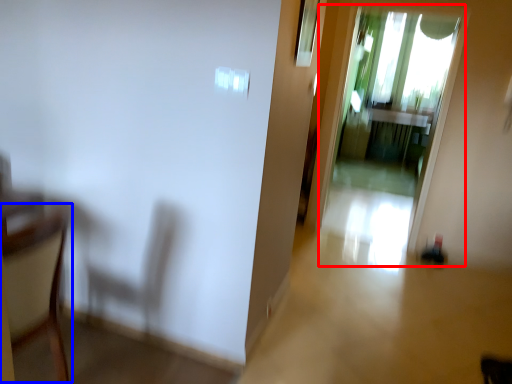
Question: Among these objects, which one is nearest to the camera, screen door (highlighted by a red box) or armchair (highlighted by a blue box)?

Choices:
 (A) screen door
 (B) armchair

Answer: (B)